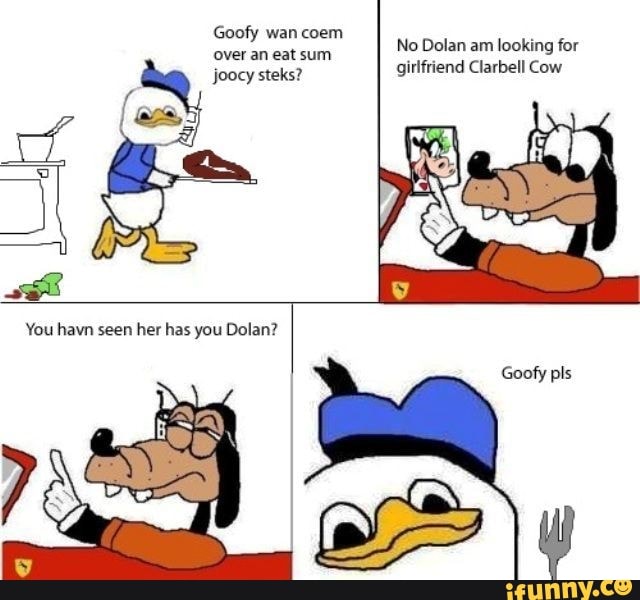
Locate an element on the screen. pot is located at coordinates (31, 144).